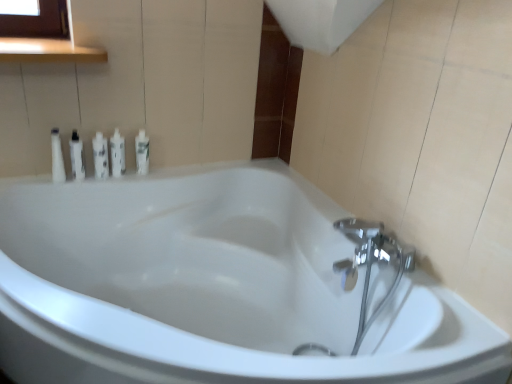
Question: Is white glossy tube at upper left, positioned as the 2th toiletry in left-to-right order, far from white glossy bottle at left, the first toiletry positioned from the left?

Choices:
 (A) no
 (B) yes

Answer: (A)

Question: Does white glossy tube at upper left, the fourth toiletry in the right-to-left sequence, lie behind white glossy bottle at left, the first toiletry positioned from the left?

Choices:
 (A) yes
 (B) no

Answer: (A)

Question: Can you confirm if white glossy tube at upper left, the fourth toiletry in the right-to-left sequence, is shorter than white glossy bottle at left, the first toiletry positioned from the left?

Choices:
 (A) no
 (B) yes

Answer: (B)

Question: Is white glossy tube at upper left, positioned as the 2th toiletry in left-to-right order, taller than white glossy bottle at left, the first toiletry positioned from the left?

Choices:
 (A) yes
 (B) no

Answer: (B)

Question: Is white glossy tube at upper left, positioned as the 2th toiletry in left-to-right order, to the right of white glossy bottle at left, the first toiletry positioned from the left, from the viewer's perspective?

Choices:
 (A) yes
 (B) no

Answer: (A)

Question: From a real-world perspective, is white glossy tube at upper left, positioned as the 2th toiletry in left-to-right order, under white glossy bottle at left, which ranks as the fifth toiletry in right-to-left order?

Choices:
 (A) yes
 (B) no

Answer: (A)

Question: Considering the relative positions of white glossy bottle at upper left, which is the 4th toiletry from left to right, and white glossy bottle at left, which ranks as the fifth toiletry in right-to-left order, in the image provided, is white glossy bottle at upper left, which is the 4th toiletry from left to right, in front of white glossy bottle at left, which ranks as the fifth toiletry in right-to-left order,?

Choices:
 (A) yes
 (B) no

Answer: (B)

Question: Considering the relative sizes of white glossy bottle at upper left, the 2th toiletry viewed from the right, and white glossy bottle at left, which ranks as the fifth toiletry in right-to-left order, in the image provided, is white glossy bottle at upper left, the 2th toiletry viewed from the right, bigger than white glossy bottle at left, which ranks as the fifth toiletry in right-to-left order,?

Choices:
 (A) yes
 (B) no

Answer: (B)

Question: Is white glossy bottle at left, which ranks as the fifth toiletry in right-to-left order, located within white glossy bottle at upper left, which is the 4th toiletry from left to right?

Choices:
 (A) yes
 (B) no

Answer: (B)

Question: From a real-world perspective, is white glossy bottle at upper left, the 2th toiletry viewed from the right, physically below white glossy bottle at left, the first toiletry positioned from the left?

Choices:
 (A) yes
 (B) no

Answer: (A)

Question: Is white glossy bottle at upper left, which is the 4th toiletry from left to right, positioned behind white glossy bottle at left, which ranks as the fifth toiletry in right-to-left order?

Choices:
 (A) no
 (B) yes

Answer: (B)

Question: Is white glossy bottle at upper left, the 2th toiletry viewed from the right, wider than white glossy bottle at left, which ranks as the fifth toiletry in right-to-left order?

Choices:
 (A) yes
 (B) no

Answer: (B)

Question: Can we say white glossy bottle at upper left, which is the 4th toiletry from left to right, lies outside white glossy bottle at upper left, which is counted as the fifth toiletry, starting from the left?

Choices:
 (A) yes
 (B) no

Answer: (A)